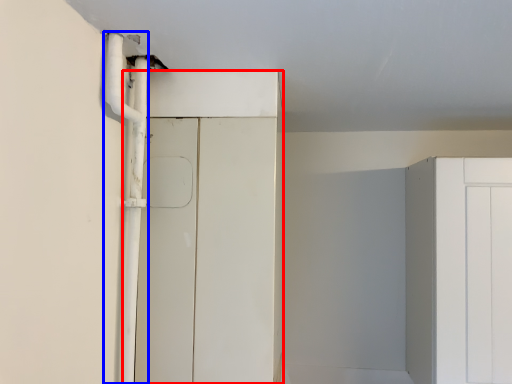
Question: Which of the following is the farthest to the observer, door (highlighted by a red box) or pipe (highlighted by a blue box)?

Choices:
 (A) door
 (B) pipe

Answer: (A)